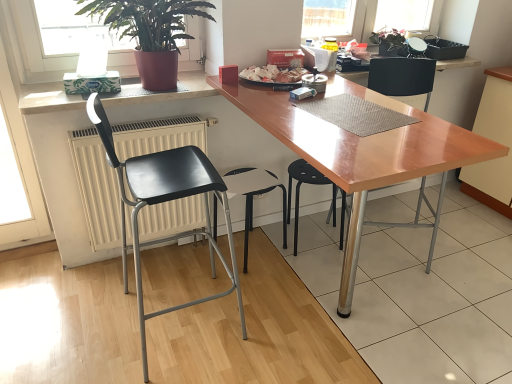
Question: From a real-world perspective, is white glossy plate at center beneath white matte counter top at upper left?

Choices:
 (A) yes
 (B) no

Answer: (B)

Question: Are white glossy plate at center and white matte counter top at upper left far apart?

Choices:
 (A) no
 (B) yes

Answer: (A)

Question: Is white glossy plate at center shorter than white matte counter top at upper left?

Choices:
 (A) yes
 (B) no

Answer: (A)

Question: From the image's perspective, is white glossy plate at center on white matte counter top at upper left?

Choices:
 (A) no
 (B) yes

Answer: (B)

Question: Does white glossy plate at center have a greater width compared to white matte counter top at upper left?

Choices:
 (A) yes
 (B) no

Answer: (B)

Question: Is white glossy plate at center oriented towards white matte counter top at upper left?

Choices:
 (A) yes
 (B) no

Answer: (B)

Question: Can we say black plastic stool at center, positioned as the third chair in right-to-left order, lies outside green matte plant at upper center, which ranks as the 2th houseplant in front-to-back order?

Choices:
 (A) yes
 (B) no

Answer: (A)

Question: From the image's perspective, is black plastic stool at center, positioned as the third chair in right-to-left order, beneath green matte plant at upper center, which ranks as the 2th houseplant in front-to-back order?

Choices:
 (A) no
 (B) yes

Answer: (B)

Question: Is black plastic stool at center, positioned as the third chair in right-to-left order, in contact with green matte plant at upper center, marked as the first houseplant in a back-to-front arrangement?

Choices:
 (A) yes
 (B) no

Answer: (B)

Question: Considering the relative positions of black plastic stool at center, positioned as the third chair in right-to-left order, and green matte plant at upper center, which ranks as the 2th houseplant in front-to-back order, in the image provided, is black plastic stool at center, positioned as the third chair in right-to-left order, to the right of green matte plant at upper center, which ranks as the 2th houseplant in front-to-back order, from the viewer's perspective?

Choices:
 (A) yes
 (B) no

Answer: (B)

Question: Does black plastic stool at center, positioned as the third chair in right-to-left order, contain green matte plant at upper center, marked as the first houseplant in a back-to-front arrangement?

Choices:
 (A) yes
 (B) no

Answer: (B)

Question: Is black plastic stool at center, positioned as the third chair in right-to-left order, to the left of green matte plant at upper center, which appears as the 1th houseplant when viewed from the right, from the viewer's perspective?

Choices:
 (A) no
 (B) yes

Answer: (B)

Question: From the image's perspective, is light wood cabinet at lower right under black plastic stool at center, placed as the second chair when sorted from right to left?

Choices:
 (A) no
 (B) yes

Answer: (A)